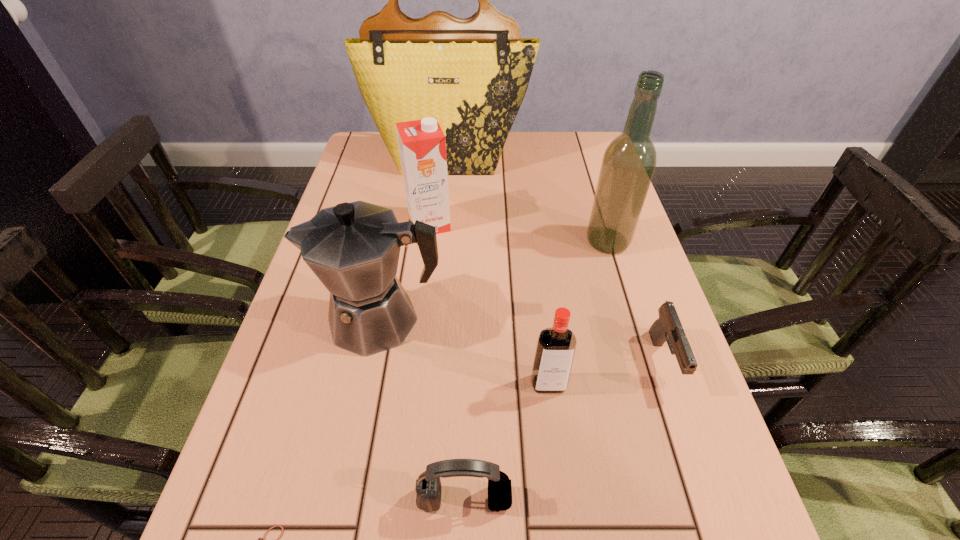
The height and width of the screenshot is (540, 960). Identify the location of the tallest object. (472, 74).

This screenshot has width=960, height=540. In order to click on tote bag in this screenshot , I will do `click(472, 74)`.

The image size is (960, 540). What are the coordinates of `the second tallest object` in the screenshot? It's located at (628, 164).

Locate an element on the screen. This screenshot has height=540, width=960. coffeepot is located at coordinates pyautogui.click(x=353, y=248).

What are the coordinates of `carton` in the screenshot? It's located at (422, 145).

Where is `vodka`? The height and width of the screenshot is (540, 960). vodka is located at coordinates (555, 350).

Identify the location of the sixth tallest object. This screenshot has width=960, height=540. (428, 487).

The width and height of the screenshot is (960, 540). In order to click on the seventh farthest object in this screenshot , I will do `click(428, 487)`.

This screenshot has width=960, height=540. What are the coordinates of `pistol` in the screenshot? It's located at (667, 328).

This screenshot has height=540, width=960. Find the location of `free region located 0.110m on the front-facing side of the tallest object`. free region located 0.110m on the front-facing side of the tallest object is located at coordinates (445, 198).